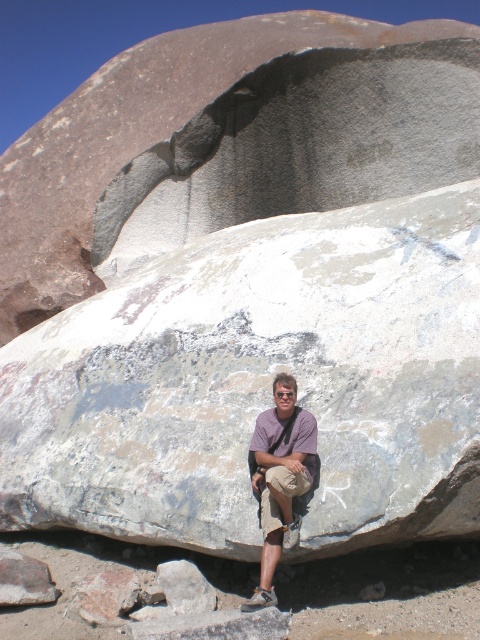
Question: Is purple cotton shirt at center to the right of khaki cotton shorts at center from the viewer's perspective?

Choices:
 (A) no
 (B) yes

Answer: (B)

Question: Among these points, which one is nearest to the camera?

Choices:
 (A) (261, 513)
 (B) (264, 476)

Answer: (A)

Question: Among these points, which one is nearest to the camera?

Choices:
 (A) (264, 496)
 (B) (307, 464)

Answer: (B)

Question: From the image, what is the correct spatial relationship of purple cotton shirt at center in relation to khaki cotton shorts at center?

Choices:
 (A) above
 (B) below

Answer: (A)

Question: Where is purple cotton shirt at center located in relation to khaki cotton shorts at center in the image?

Choices:
 (A) below
 (B) above

Answer: (B)